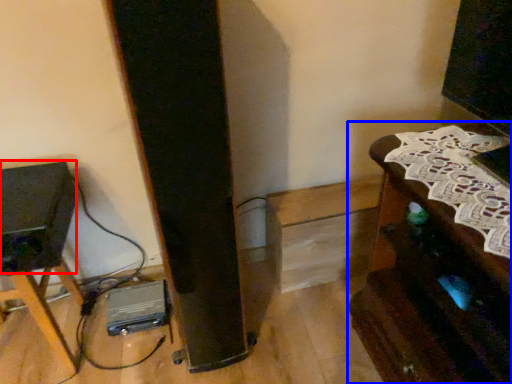
Question: Which point is further to the camera, speaker (highlighted by a red box) or furniture (highlighted by a blue box)?

Choices:
 (A) speaker
 (B) furniture

Answer: (A)